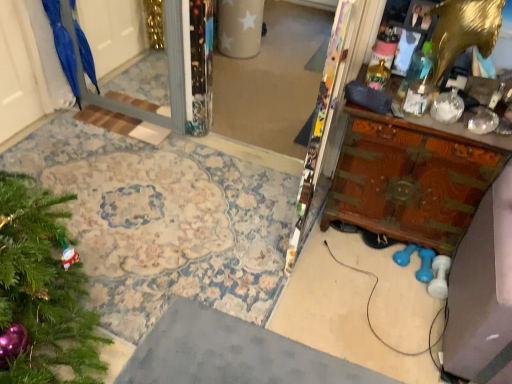
Question: Which is correct: wooden carved vanity at right is inside blue matte umbrella at left, or outside of it?

Choices:
 (A) outside
 (B) inside

Answer: (A)

Question: Looking at their shapes, would you say wooden carved vanity at right is wider or thinner than blue matte umbrella at left?

Choices:
 (A) wide
 (B) thin

Answer: (A)

Question: From a real-world perspective, is wooden carved vanity at right physically located above or below blue matte umbrella at left?

Choices:
 (A) above
 (B) below

Answer: (B)

Question: Does point (96, 86) appear closer or farther from the camera than point (390, 135)?

Choices:
 (A) closer
 (B) farther

Answer: (B)

Question: Looking at the image, does blue matte umbrella at left seem bigger or smaller compared to wooden carved vanity at right?

Choices:
 (A) big
 (B) small

Answer: (B)

Question: Based on their positions, is blue matte umbrella at left located to the left or right of wooden carved vanity at right?

Choices:
 (A) right
 (B) left

Answer: (B)

Question: From the image's perspective, is blue matte umbrella at left above or below wooden carved vanity at right?

Choices:
 (A) above
 (B) below

Answer: (A)